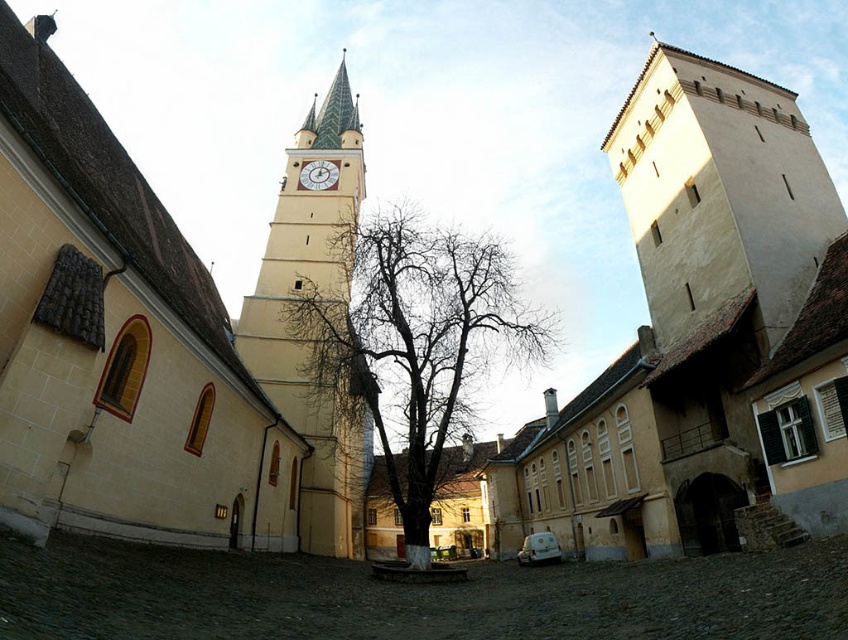
Question: Which of the following is the farthest from the observer?

Choices:
 (A) smooth cream-colored clock tower at center
 (B) bare branches at center

Answer: (A)

Question: Considering the real-world distances, which object is closest to the bare branches at center?

Choices:
 (A) beige stone tower at right
 (B) smooth cream-colored clock tower at center

Answer: (B)

Question: Which point is closer to the camera?

Choices:
 (A) smooth cream-colored clock tower at center
 (B) bare branches at center
 (C) matte white clock at center

Answer: (B)

Question: Does matte yellow church tower at upper center appear over matte white clock at center?

Choices:
 (A) no
 (B) yes

Answer: (A)

Question: Does matte yellow church tower at upper center come in front of matte white clock at center?

Choices:
 (A) yes
 (B) no

Answer: (A)

Question: Does matte yellow church tower at upper center appear on the right side of matte white clock at center?

Choices:
 (A) no
 (B) yes

Answer: (A)